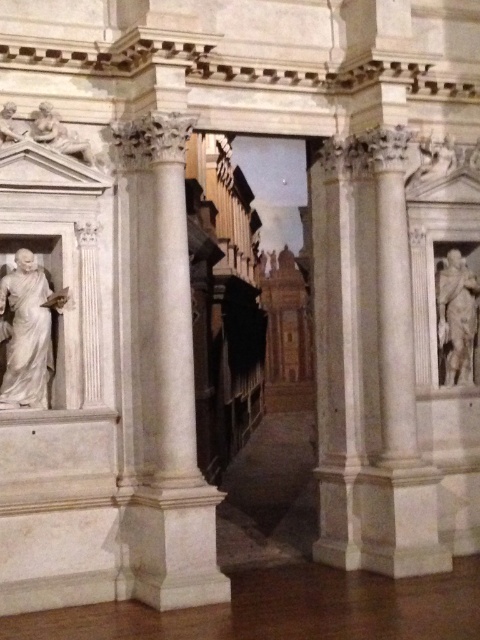
Between white marble column at center and white marble statue at right, which one is positioned lower?

white marble column at center is lower down.

Does white marble column at center have a smaller size compared to white marble statue at right?

No.

Which is in front, point (172, 173) or point (458, 260)?

Point (172, 173) is more forward.

Identify the location of white marble column at center. (166, 378).

Does white marble column at center appear under white marble statue at left?

Yes, white marble column at center is below white marble statue at left.

Between white marble column at center and white marble statue at left, which one is positioned higher?

white marble statue at left is higher up.

Which is behind, point (176, 326) or point (28, 291)?

The point (28, 291) is behind.

Where is `white marble column at center`? This screenshot has width=480, height=640. white marble column at center is located at coordinates (166, 378).

Is white marble statue at left further to camera compared to white marble statue at right?

No, it is in front of white marble statue at right.

Is white marble statue at left above white marble statue at right?

Incorrect, white marble statue at left is not positioned above white marble statue at right.

Which is behind, point (35, 328) or point (469, 292)?

Point (469, 292)

You are a GUI agent. You are given a task and a screenshot of the screen. Output one action in this format:
    pyautogui.click(x=<x>, y=<y>)
    Task: Click on the white marble statue at left
    
    Given the screenshot: What is the action you would take?
    pyautogui.click(x=26, y=332)